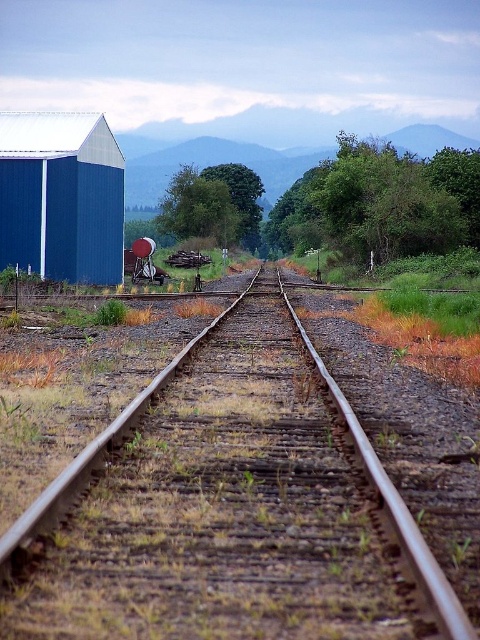
Between rusty metal tracks at center and blue matte barn at left, which one is positioned higher?

blue matte barn at left is above.

Is point (372, 634) more distant than point (56, 228)?

No, (372, 634) is closer to viewer.

Locate an element on the screen. This screenshot has width=480, height=640. rusty metal tracks at center is located at coordinates (255, 500).